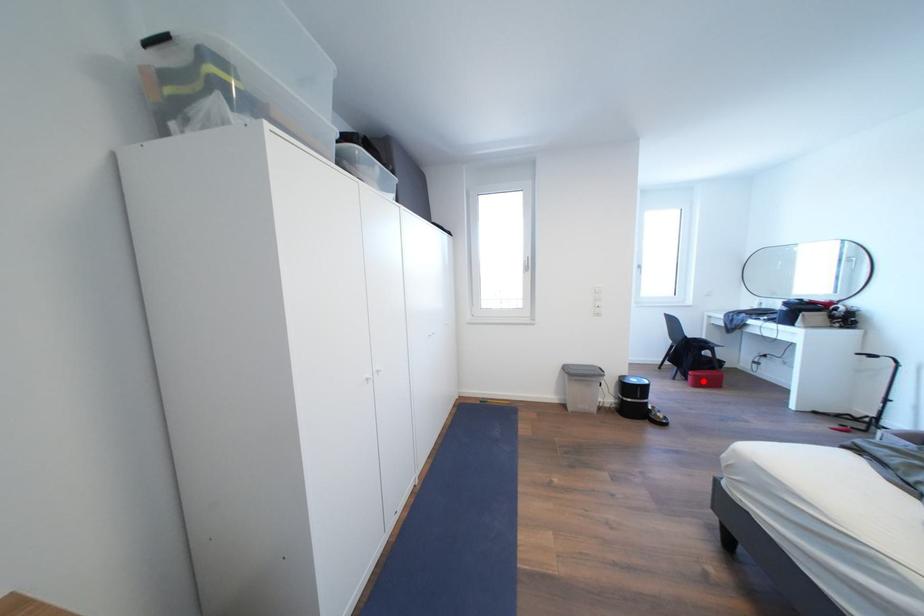
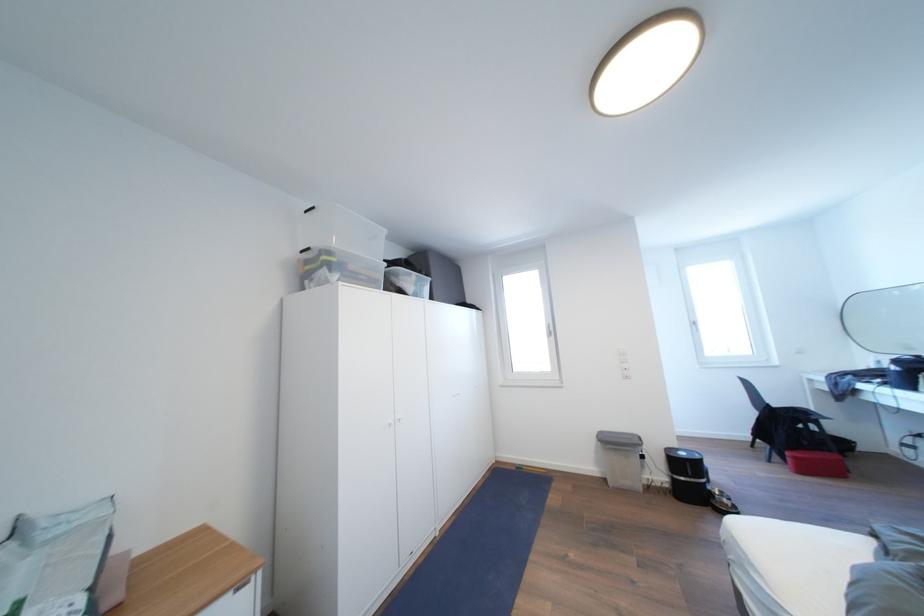
Question: I am providing you with two images of the same scene from different viewpoints. In image1, a red point is highlighted. Considering the same 3D point in image2, which of the following is correct?

Choices:
 (A) It is closer
 (B) It is farther

Answer: (B)